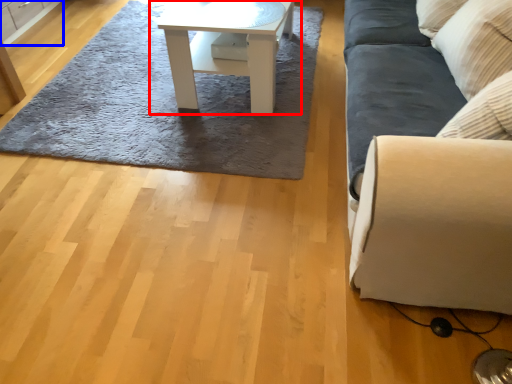
Question: Which point is closer to the camera, table (highlighted by a red box) or cabinetry (highlighted by a blue box)?

Choices:
 (A) table
 (B) cabinetry

Answer: (A)